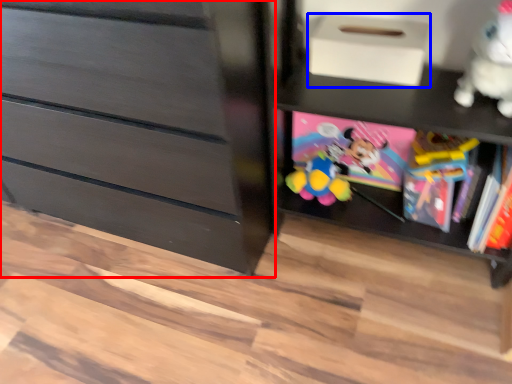
Question: Which point is further to the camera, chest of drawers (highlighted by a red box) or shoe box (highlighted by a blue box)?

Choices:
 (A) chest of drawers
 (B) shoe box

Answer: (B)